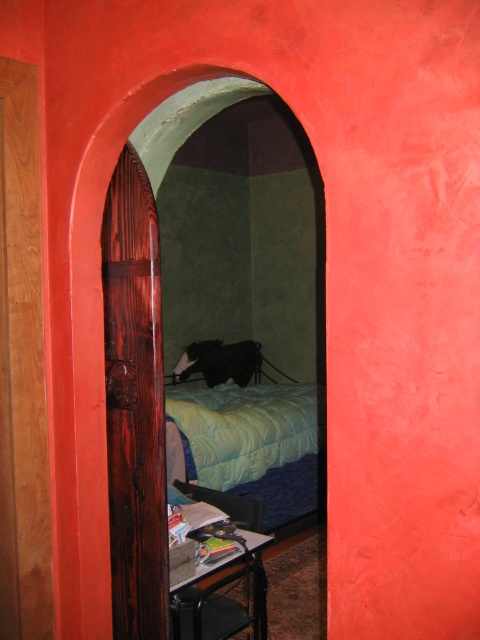
Consider the image. Is wooden door at center smaller than blue quilted bed at center?

Correct, wooden door at center occupies less space than blue quilted bed at center.

Between wooden door at center and blue quilted bed at center, which one appears on the left side from the viewer's perspective?

Positioned to the left is wooden door at center.

Where is `wooden door at center`? The image size is (480, 640). wooden door at center is located at coordinates (134, 401).